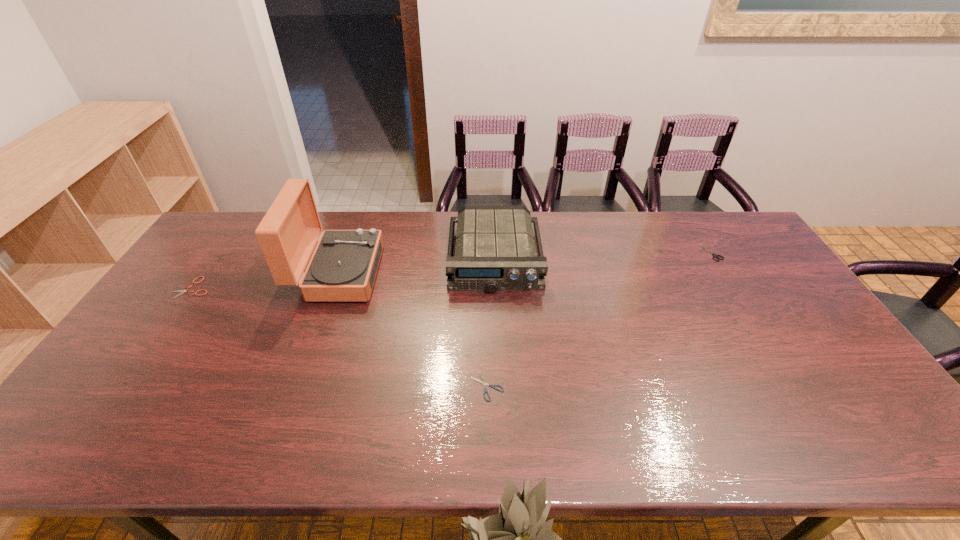
In the image, there is a desktop. Identify the location of free space at the far edge. [555, 246].

The image size is (960, 540). In the image, there is a desktop. Find the location of `vacant space at the near edge`. vacant space at the near edge is located at coordinates (493, 453).

I want to click on vacant space at the left edge, so click(x=172, y=335).

Image resolution: width=960 pixels, height=540 pixels. What are the coordinates of `vacant space at the right edge` in the screenshot? It's located at (812, 363).

This screenshot has height=540, width=960. Identify the location of vacant space at the far left corner of the desktop. (252, 211).

I want to click on vacant space at the near right corner of the desktop, so click(x=876, y=444).

Identify the location of free point between the third shortest object and the shortest object. [x=600, y=319].

Identify the location of free space between the second shears from left to right and the radio receiver. (491, 322).

You are a GUI agent. You are given a task and a screenshot of the screen. Output one action in this format:
    pyautogui.click(x=<x>, y=<y>)
    Task: Click on the vacant area between the second object from left to right and the leftmost shears
    The height and width of the screenshot is (540, 960).
    Given the screenshot: What is the action you would take?
    pyautogui.click(x=265, y=280)

Locate an element on the screen. The height and width of the screenshot is (540, 960). vacant area between the fourth object from right to left and the leftmost shears is located at coordinates (265, 280).